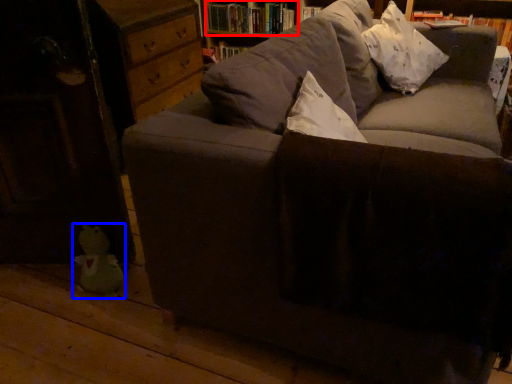
Question: Which object is closer to the camera taking this photo, book (highlighted by a red box) or toy (highlighted by a blue box)?

Choices:
 (A) book
 (B) toy

Answer: (B)